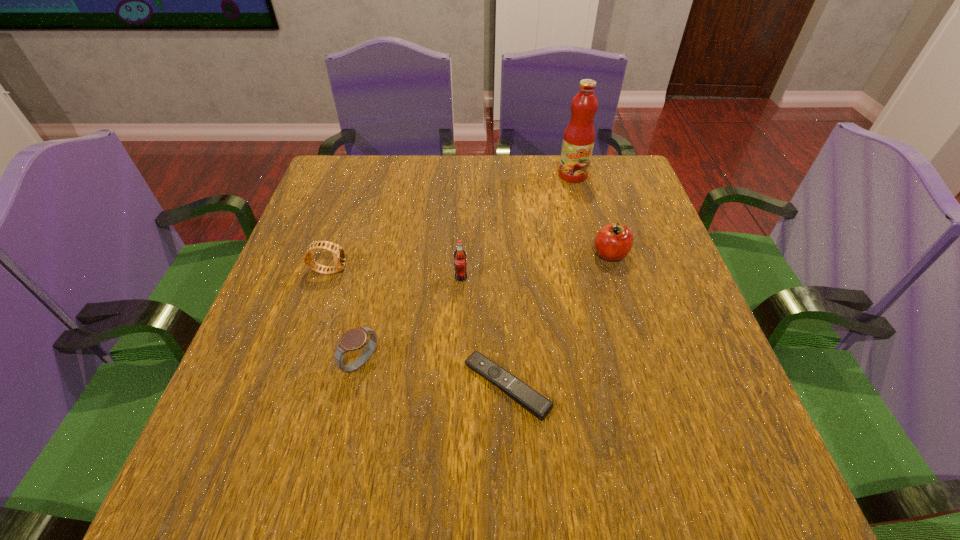
Where is `the tallest object`? The image size is (960, 540). the tallest object is located at coordinates (578, 141).

Locate an element on the screen. fruit juice is located at coordinates (578, 141).

At what (x,y) coordinates should I click in order to perform the action: click on the second tallest object. Please return your answer as a coordinate pair (x, y). Looking at the image, I should click on (460, 263).

Identify the location of apple. (613, 242).

The image size is (960, 540). What are the coordinates of `the left watch` in the screenshot? It's located at (337, 251).

At what (x,y) coordinates should I click in order to perform the action: click on the farther watch. Please return your answer as a coordinate pair (x, y). This screenshot has height=540, width=960. Looking at the image, I should click on (337, 251).

Where is `the nearer watch`? The height and width of the screenshot is (540, 960). the nearer watch is located at coordinates (353, 339).

Where is `the fifth object from right to left`? The width and height of the screenshot is (960, 540). the fifth object from right to left is located at coordinates (353, 339).

The width and height of the screenshot is (960, 540). Find the location of `remote control`. remote control is located at coordinates (520, 392).

Identify the location of free location located 0.270m on the front label of the tallest object. The width and height of the screenshot is (960, 540). (592, 248).